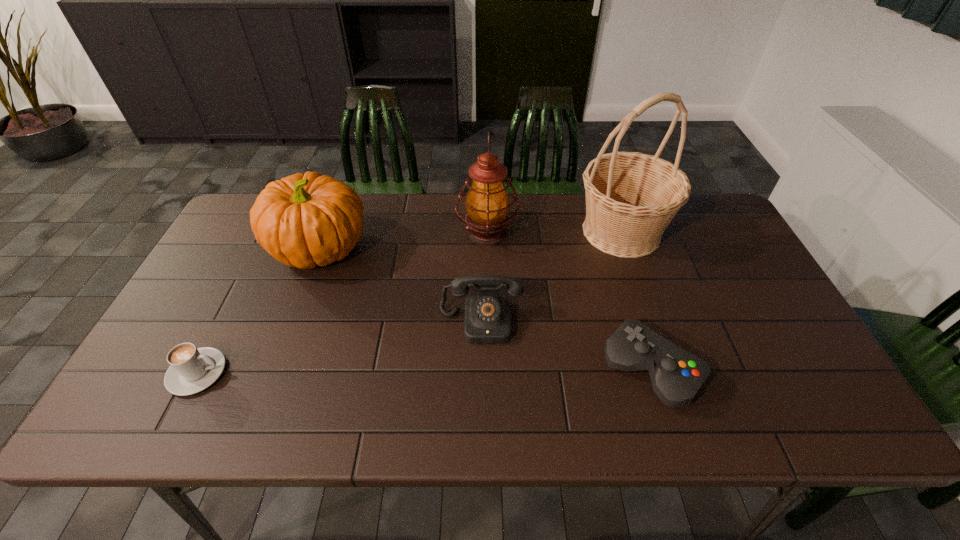
At what (x,y) coordinates should I click in order to perform the action: click on free point between the telephone and the cappuccino. Please return your answer as a coordinate pair (x, y). Image resolution: width=960 pixels, height=540 pixels. Looking at the image, I should click on (339, 348).

Where is `empty space between the fifth shortest object and the tallest object`? empty space between the fifth shortest object and the tallest object is located at coordinates (554, 232).

Locate an element on the screen. The width and height of the screenshot is (960, 540). free space between the fifth shortest object and the cappuccino is located at coordinates (342, 303).

Where is `object that can be found as the fourth closest to the oil lamp`? This screenshot has height=540, width=960. object that can be found as the fourth closest to the oil lamp is located at coordinates (676, 375).

Locate an element on the screen. This screenshot has width=960, height=540. object identified as the fourth closest to the basket is located at coordinates (304, 220).

Where is `vacant region that satisfies the following two spatial constraints: 1. on the front side of the control; 2. on the left side of the oil lamp`? The height and width of the screenshot is (540, 960). vacant region that satisfies the following two spatial constraints: 1. on the front side of the control; 2. on the left side of the oil lamp is located at coordinates (490, 369).

I want to click on free spot that satisfies the following two spatial constraints: 1. on the dial of the control; 2. on the right side of the telephone, so click(x=481, y=369).

Image resolution: width=960 pixels, height=540 pixels. What are the coordinates of `vacant space that satisfies the following two spatial constraints: 1. on the front side of the tallest object; 2. to the right of the cappuccino` in the screenshot? It's located at click(x=670, y=373).

This screenshot has width=960, height=540. What are the coordinates of `vacant point that satisfies the following two spatial constraints: 1. on the front side of the control; 2. to the right of the cappuccino` in the screenshot? It's located at (652, 373).